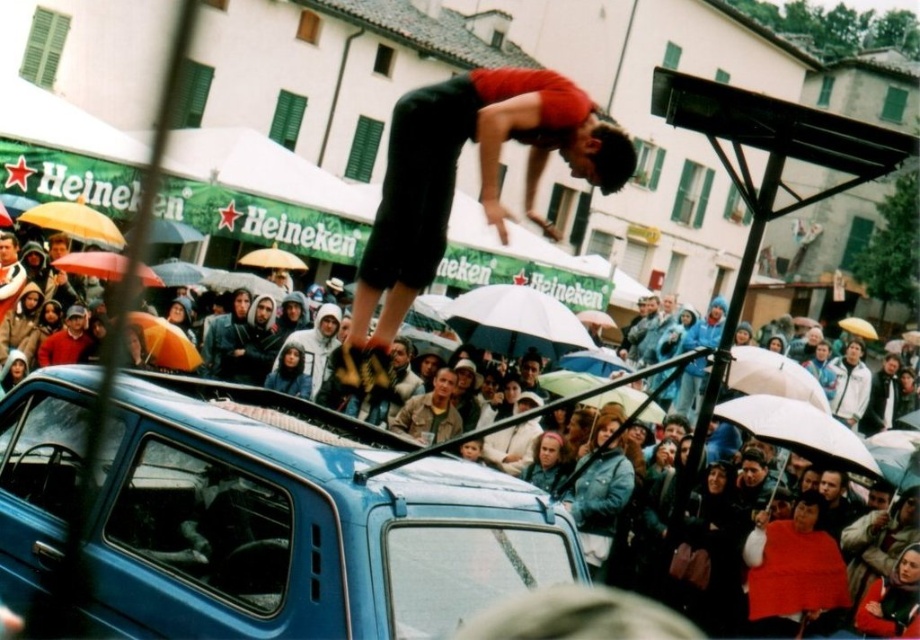
Can you confirm if matte black jacket at center is shorter than white matte umbrella at center?

Incorrect, matte black jacket at center's height does not fall short of white matte umbrella at center's.

Can you confirm if matte black jacket at center is wider than white matte umbrella at center?

Indeed, matte black jacket at center has a greater width compared to white matte umbrella at center.

What do you see at coordinates (297, 524) in the screenshot? I see `matte black jacket at center` at bounding box center [297, 524].

Identify the location of matte black jacket at center. This screenshot has height=640, width=920. (297, 524).

Does blue matte car at center appear on the left side of matte black jacket at center?

Yes, blue matte car at center is to the left of matte black jacket at center.

Which is more to the right, blue matte car at center or matte black jacket at center?

Positioned to the right is matte black jacket at center.

Is point (370, 588) positioned in front of point (240, 596)?

Yes, point (370, 588) is in front of point (240, 596).

Locate an element on the screen. blue matte car at center is located at coordinates (299, 522).

Can you confirm if blue matte car at center is positioned to the right of white matte umbrella at center?

Incorrect, blue matte car at center is not on the right side of white matte umbrella at center.

Which is in front, point (317, 456) or point (556, 310)?

Point (317, 456)

The image size is (920, 640). Describe the element at coordinates (299, 522) in the screenshot. I see `blue matte car at center` at that location.

The image size is (920, 640). I want to click on blue matte car at center, so click(x=299, y=522).